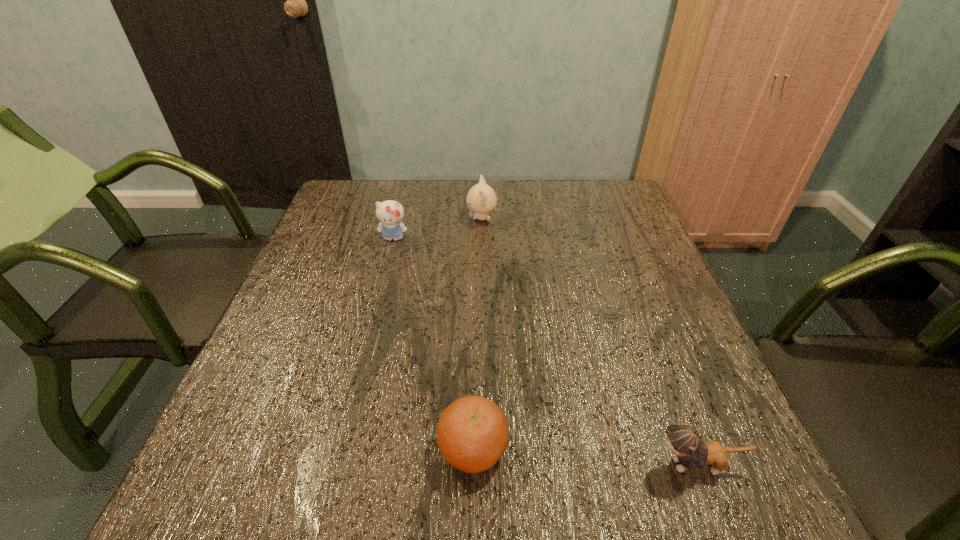
What are the coordinates of `free space at the far edge of the desktop` in the screenshot? It's located at click(407, 212).

The width and height of the screenshot is (960, 540). I want to click on free spot at the near edge of the desktop, so click(x=403, y=475).

This screenshot has height=540, width=960. In the image, there is a desktop. Find the location of `vacant space at the left edge`. vacant space at the left edge is located at coordinates (241, 421).

Where is `vacant space at the far right corner of the desktop`? The width and height of the screenshot is (960, 540). vacant space at the far right corner of the desktop is located at coordinates (608, 216).

Locate an element on the screen. empty location between the leftmost kitten and the clementine is located at coordinates (433, 343).

You are a GUI agent. You are given a task and a screenshot of the screen. Output one action in this format:
    pyautogui.click(x=<x>, y=<y>)
    Task: Click on the free space between the leftmost kitten and the rightmost object
    This screenshot has height=540, width=960.
    Given the screenshot: What is the action you would take?
    pyautogui.click(x=545, y=352)

The height and width of the screenshot is (540, 960). In order to click on vacant area that lies between the farthest object and the clementine in this screenshot , I will do `click(477, 333)`.

In order to click on empty space between the farthest kitten and the rightmost object in this screenshot , I will do `click(589, 341)`.

Identify the location of free spot between the clementine and the farthest object. The width and height of the screenshot is (960, 540). (477, 333).

Where is `vacant space that's between the second kitten from left to right and the rightmost kitten`? The image size is (960, 540). vacant space that's between the second kitten from left to right and the rightmost kitten is located at coordinates (589, 341).